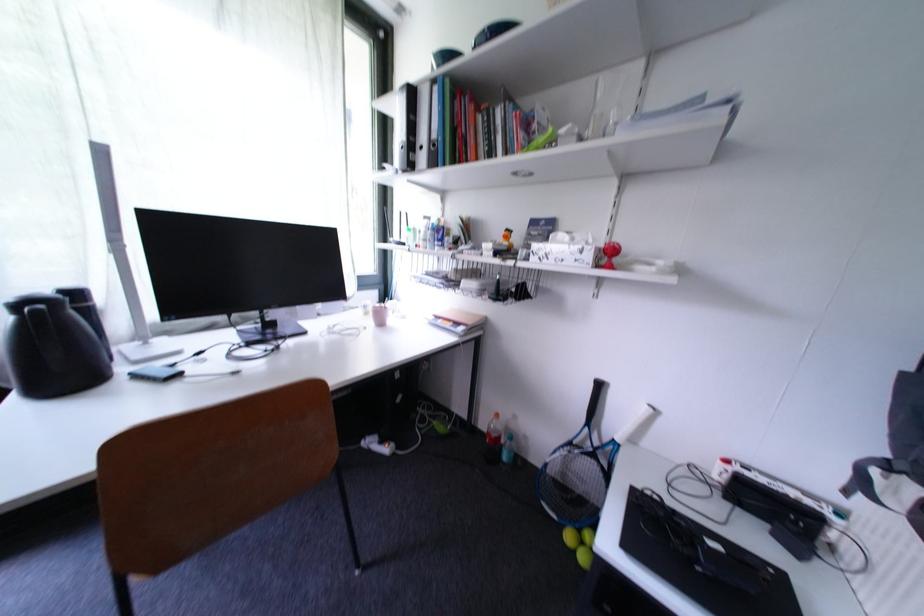
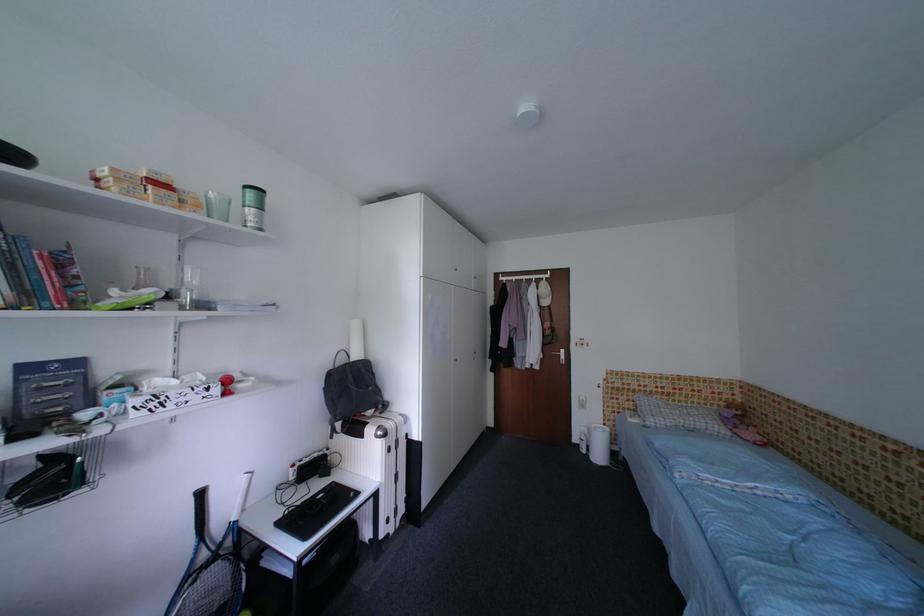
Question: The camera is either moving clockwise (left) or counter-clockwise (right) around the object. The first image is from the beginning of the video and the second image is from the end. Is the camera moving left or right when shooting the video?

Choices:
 (A) Left
 (B) Right

Answer: (A)